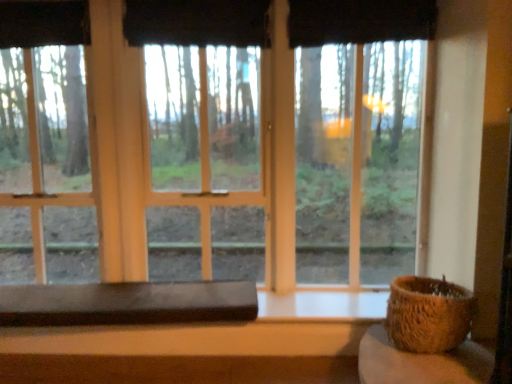
Question: Is white matte window sill at lower center taller or shorter than black fabric curtain at upper center, the 1th curtain when ordered from left to right?

Choices:
 (A) short
 (B) tall

Answer: (A)

Question: From a real-world perspective, is white matte window sill at lower center above or below black fabric curtain at upper center, the second curtain from the right?

Choices:
 (A) above
 (B) below

Answer: (B)

Question: Estimate the real-world distances between objects in this image. Which object is closer to the black fabric curtain at upper center, the first curtain viewed from the right?

Choices:
 (A) transparent glass window at center
 (B) white matte window sill at lower center
 (C) brown woven basket at right
 (D) rustic woven basket at lower right, placed as the 1th table when sorted from front to back
 (E) black fabric curtain at upper center, the second curtain from the right

Answer: (E)

Question: Which object is the farthest from the black fabric curtain at upper center, the second curtain from the right?

Choices:
 (A) rustic woven basket at lower right, placed as the 1th table when sorted from front to back
 (B) dark brown wood table at lower center, the first table viewed from the left
 (C) white matte window sill at lower center
 (D) black fabric curtain at upper center, which ranks as the second curtain in left-to-right order
 (E) brown woven basket at right

Answer: (A)